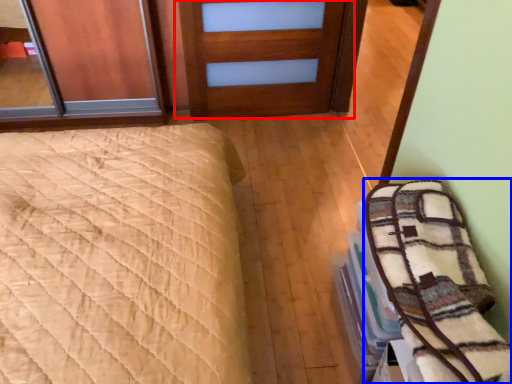
Question: Which object appears closest to the camera in this image, door (highlighted by a red box) or bedding (highlighted by a blue box)?

Choices:
 (A) door
 (B) bedding

Answer: (B)